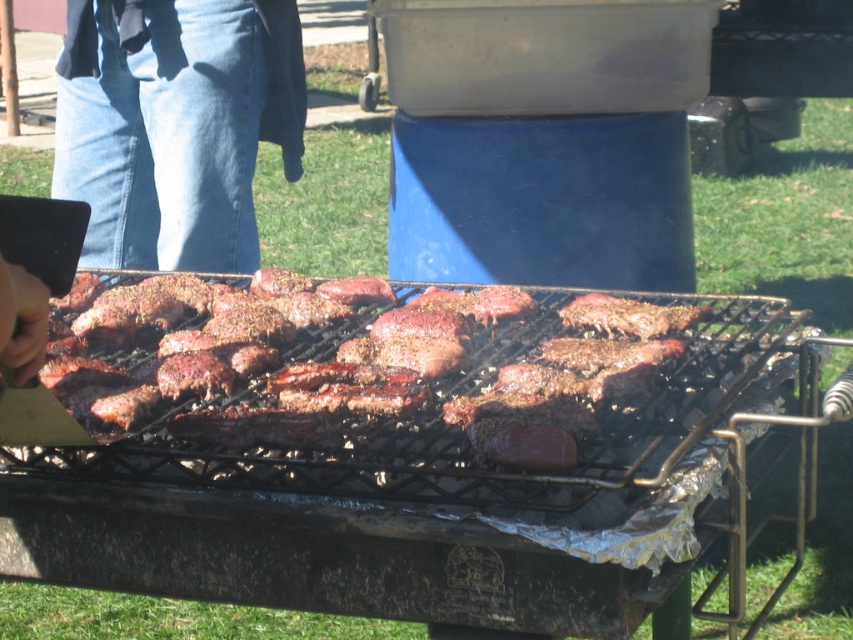
Question: Is the position of grilled meat at center less distant than that of denim jeans at left?

Choices:
 (A) no
 (B) yes

Answer: (B)

Question: Which point is farther to the camera?

Choices:
 (A) (358, 413)
 (B) (107, 252)

Answer: (B)

Question: Is grilled meat at center below denim jeans at left?

Choices:
 (A) no
 (B) yes

Answer: (B)

Question: Which point is closer to the camera?

Choices:
 (A) grilled meat at center
 (B) denim jeans at left

Answer: (A)

Question: Is grilled meat at center thinner than denim jeans at left?

Choices:
 (A) no
 (B) yes

Answer: (A)